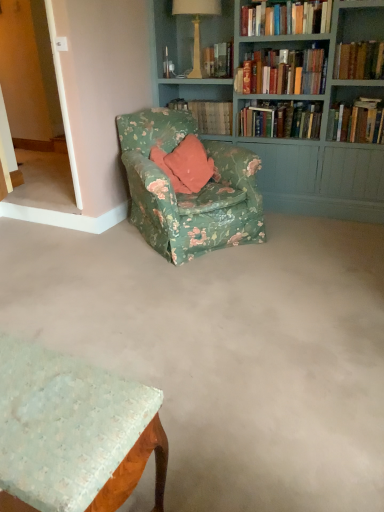
Question: From a real-world perspective, is hardcover books at upper center, the second book from the left, physically above floral fabric armchair at center?

Choices:
 (A) yes
 (B) no

Answer: (A)

Question: Does hardcover books at upper center, the second book from the left, have a greater height compared to floral fabric armchair at center?

Choices:
 (A) yes
 (B) no

Answer: (B)

Question: Would you say floral fabric armchair at center is part of hardcover books at upper center, positioned as the fifth book in right-to-left order,'s contents?

Choices:
 (A) yes
 (B) no

Answer: (B)

Question: Is hardcover books at upper center, the second book from the left, to the left of floral fabric armchair at center from the viewer's perspective?

Choices:
 (A) no
 (B) yes

Answer: (A)

Question: Does hardcover books at upper center, positioned as the fifth book in right-to-left order, have a lesser height compared to floral fabric armchair at center?

Choices:
 (A) no
 (B) yes

Answer: (B)

Question: Is hardcover books at upper center, positioned as the fifth book in right-to-left order, bigger than floral fabric armchair at center?

Choices:
 (A) yes
 (B) no

Answer: (B)

Question: Considering the relative sizes of floral fabric book at center, which is the sixth book from right to left, and floral fabric armchair at center in the image provided, is floral fabric book at center, which is the sixth book from right to left, thinner than floral fabric armchair at center?

Choices:
 (A) no
 (B) yes

Answer: (B)

Question: Is floral fabric book at center, which is the first book in left-to-right order, directly adjacent to floral fabric armchair at center?

Choices:
 (A) no
 (B) yes

Answer: (A)

Question: Is floral fabric book at center, which is the sixth book from right to left, to the right of floral fabric armchair at center from the viewer's perspective?

Choices:
 (A) no
 (B) yes

Answer: (B)

Question: Is floral fabric book at center, which is the sixth book from right to left, to the left of floral fabric armchair at center from the viewer's perspective?

Choices:
 (A) no
 (B) yes

Answer: (A)

Question: Is floral fabric armchair at center a part of floral fabric book at center, which is the first book in left-to-right order?

Choices:
 (A) yes
 (B) no

Answer: (B)

Question: Is floral fabric book at center, which is the sixth book from right to left, not close to floral fabric armchair at center?

Choices:
 (A) yes
 (B) no

Answer: (B)

Question: Does teal painted wood bookcase at upper right come in front of matte cream lamp at upper center?

Choices:
 (A) yes
 (B) no

Answer: (A)